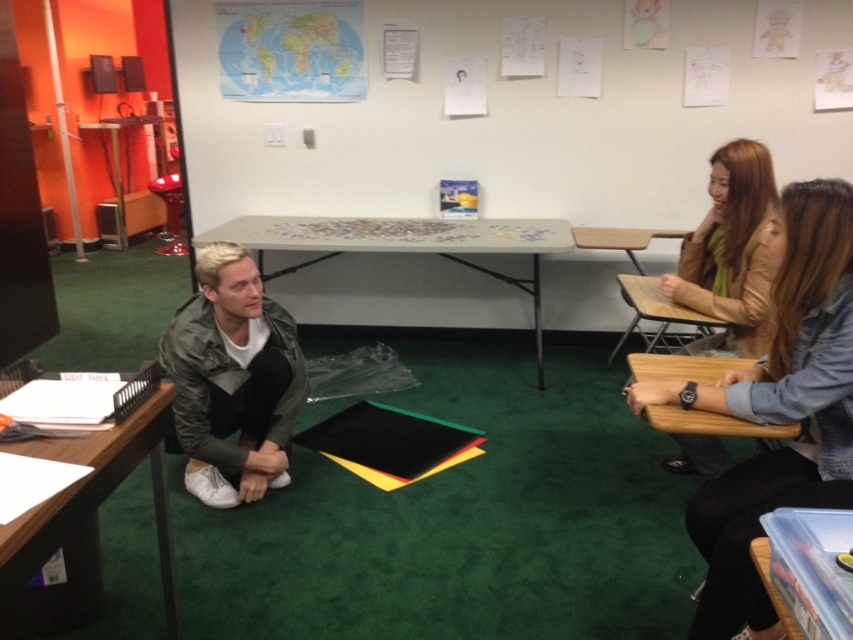
Question: Is matte brown leather jacket at right above beige plastic table at center?

Choices:
 (A) yes
 (B) no

Answer: (A)

Question: Does wooden desk at lower left appear on the right side of wooden desk at right?

Choices:
 (A) no
 (B) yes

Answer: (A)

Question: Which point is closer to the camera?

Choices:
 (A) (711, 161)
 (B) (247, 236)

Answer: (A)

Question: Which object is the farthest from the beige plastic table at center?

Choices:
 (A) wooden table at right
 (B) wooden desk at lower left
 (C) wooden desk at right

Answer: (B)

Question: Considering the relative positions of wooden table at right and wooden desk at right in the image provided, where is wooden table at right located with respect to wooden desk at right?

Choices:
 (A) above
 (B) below

Answer: (B)

Question: Estimate the real-world distances between objects in this image. Which object is closer to the wooden desk at lower left?

Choices:
 (A) beige plastic table at center
 (B) wooden desk at right
 (C) wooden table at right
 (D) camouflage jacket at lower left

Answer: (D)